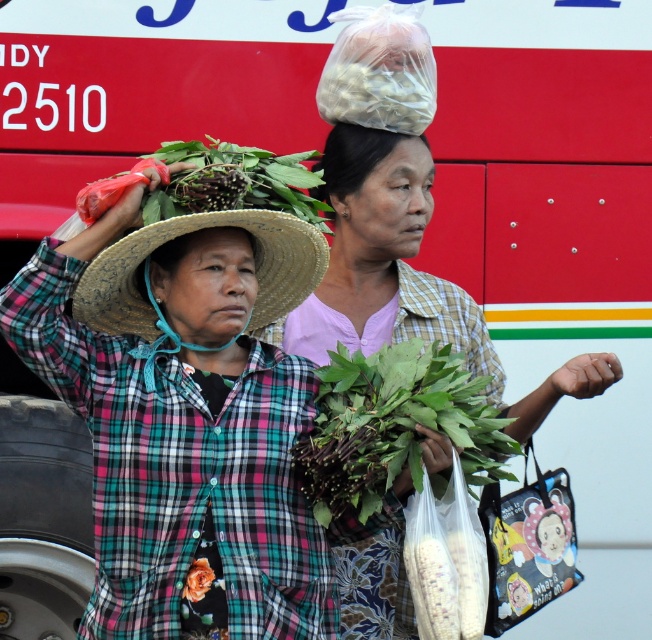
You are standing in front of the two women in the market scene. You need to determine which of the two points, point (323,147) or point (188,572), is closer to you. Which one is closer?

Point (323,147) is closer to you because it is further to the viewer than point (188,572).

You are a photographer trying to capture a photo of both the natural straw hat at left and the matte brown hat at center. Which hat should you focus on first if you want to ensure both are in the frame?

The natural straw hat at left is located below the matte brown hat at center, so you should focus on the matte brown hat at center first to ensure both hats are within the frame.

You are standing in a market and see the natural straw hat at left. If you want to hand a small item to the person wearing it, can you reach them without moving closer?

The natural straw hat at left is 4.49 meters from viewer. Since the distance is over 4 meters, you cannot reach them without moving closer.